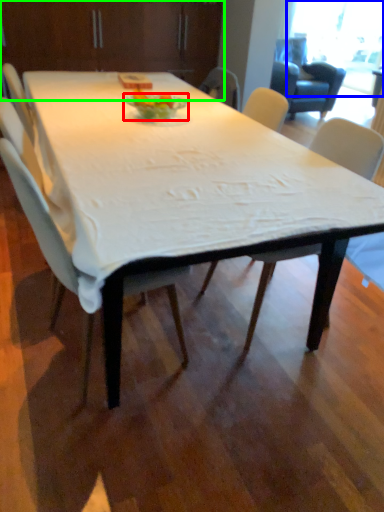
Question: Which is farther away from plate (highlighted by a red box)? window screen (highlighted by a blue box) or dresser (highlighted by a green box)?

Choices:
 (A) window screen
 (B) dresser

Answer: (A)